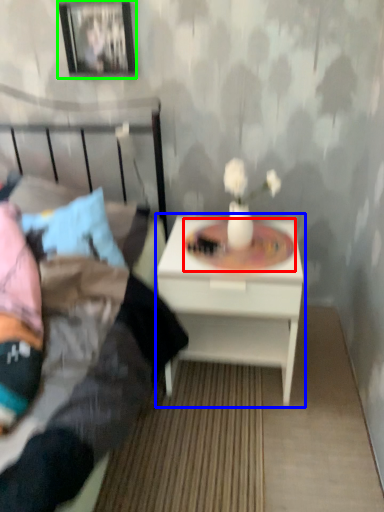
Question: Based on their relative distances, which object is nearer to round table (highlighted by a red box)? Choose from nightstand (highlighted by a blue box) and picture frame (highlighted by a green box).

Choices:
 (A) nightstand
 (B) picture frame

Answer: (A)